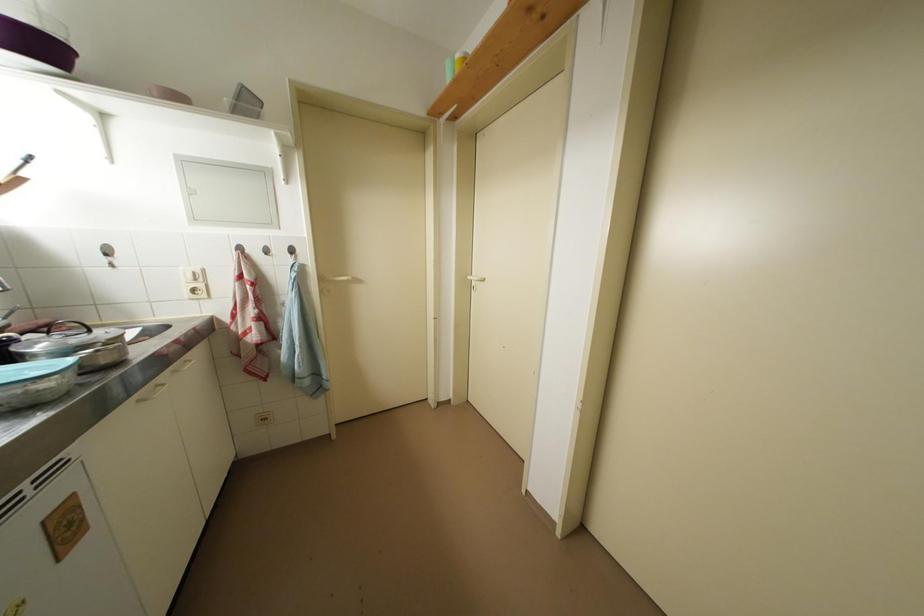
Locate an element on the screen. The image size is (924, 616). knife handle is located at coordinates (18, 167).